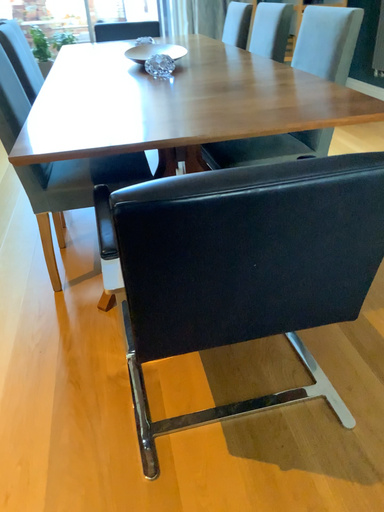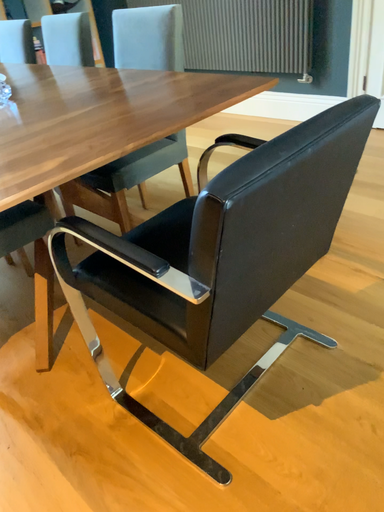
Question: How did the camera likely rotate when shooting the video?

Choices:
 (A) rotated downward
 (B) rotated upward

Answer: (B)